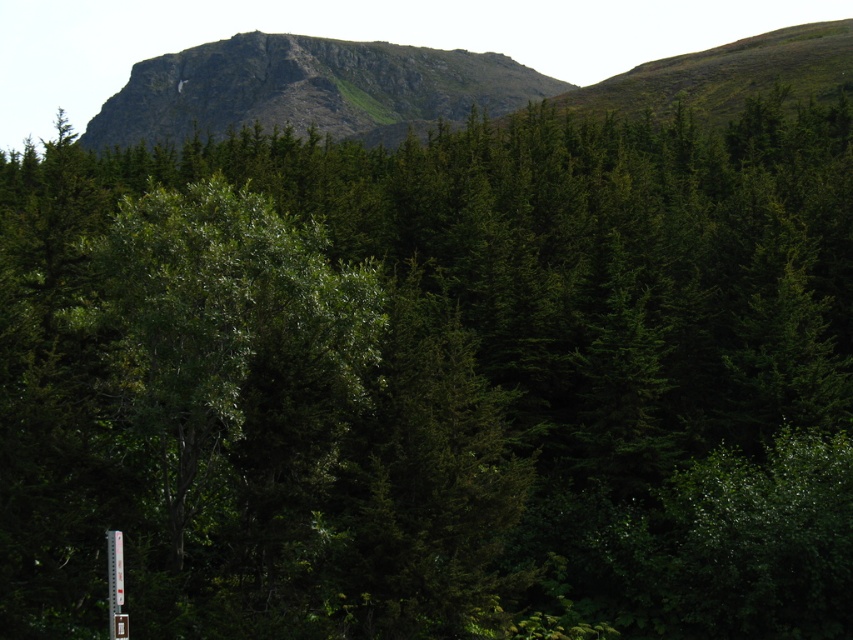
Question: Is rugged rock mountain at upper center further to the viewer compared to white plastic sign at lower left?

Choices:
 (A) no
 (B) yes

Answer: (B)

Question: Can you confirm if rugged rock mountain at upper center is thinner than white plastic sign at lower left?

Choices:
 (A) no
 (B) yes

Answer: (A)

Question: Which of the following is the farthest from the observer?

Choices:
 (A) rugged rock mountain at upper center
 (B) white plastic sign at lower left

Answer: (A)

Question: Is rugged rock mountain at upper center thinner than white plastic sign at lower left?

Choices:
 (A) no
 (B) yes

Answer: (A)